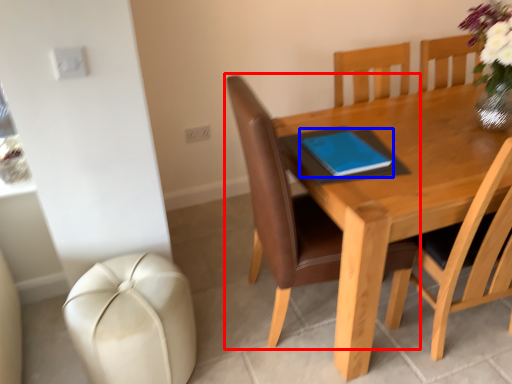
Question: Among these objects, which one is nearest to the camera, chair (highlighted by a red box) or notebook (highlighted by a blue box)?

Choices:
 (A) chair
 (B) notebook

Answer: (A)